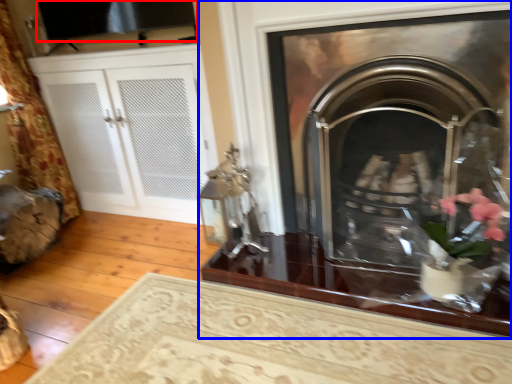
Question: Which object appears farthest to the camera in this image, window screen (highlighted by a red box) or fireplace (highlighted by a blue box)?

Choices:
 (A) window screen
 (B) fireplace

Answer: (A)